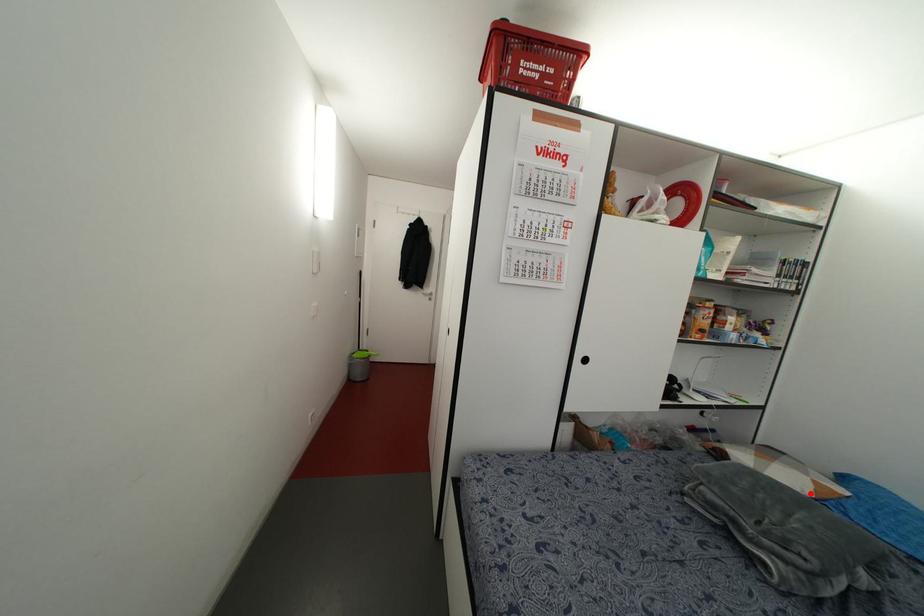
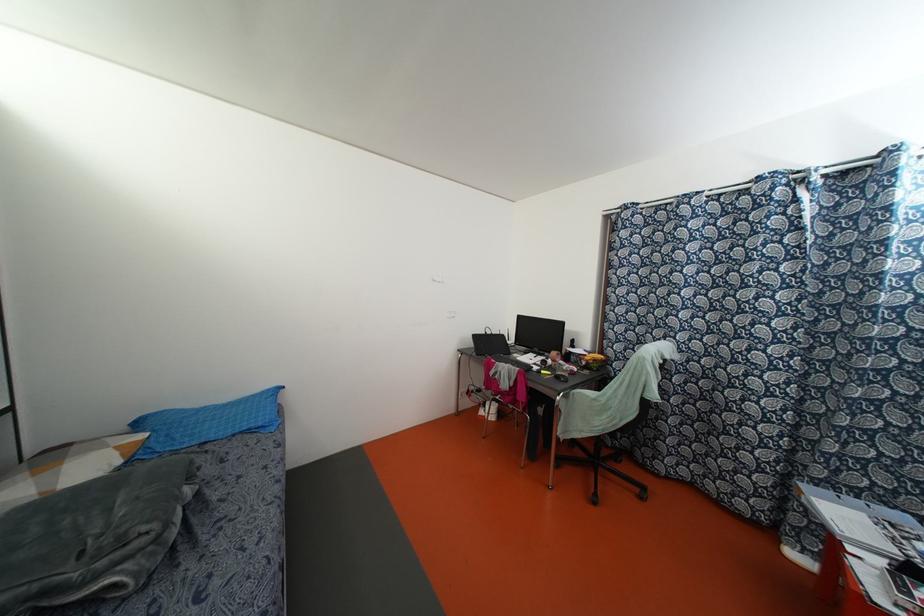
The point at the highlighted location is marked in the first image. Where is the corresponding point in the second image?

(118, 461)